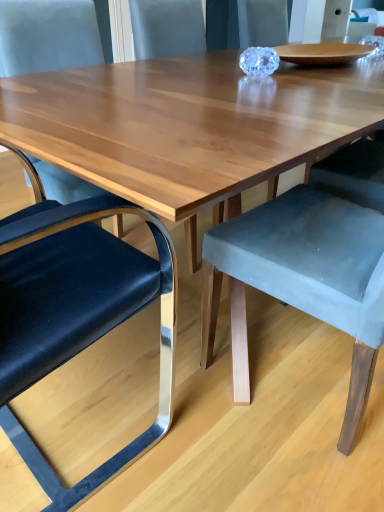
The height and width of the screenshot is (512, 384). In order to click on vacant space in metallic blue cushioned chair at left, the 1th chair from the left (from a real-world perspective) in this screenshot , I will do `click(71, 422)`.